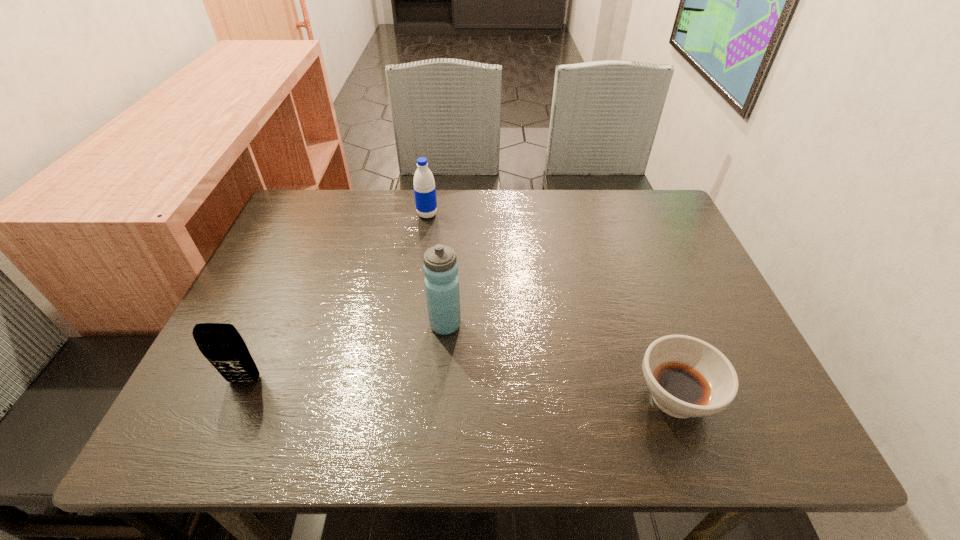
Identify the location of vacant position located 0.140m on the back of the shortest object. (645, 313).

Identify the location of object situated at the far edge. (424, 185).

At what (x,y) coordinates should I click in order to perform the action: click on object that is positioned at the near edge. Please return your answer as a coordinate pair (x, y). This screenshot has height=540, width=960. Looking at the image, I should click on (687, 377).

You are a GUI agent. You are given a task and a screenshot of the screen. Output one action in this format:
    pyautogui.click(x=<x>, y=<y>)
    Task: Click on the object positioned at the left edge
    This screenshot has width=960, height=540.
    Given the screenshot: What is the action you would take?
    [221, 344]

Find the location of a particular element. object located at the right edge is located at coordinates (687, 377).

Image resolution: width=960 pixels, height=540 pixels. Find the location of `object at the near right corner`. object at the near right corner is located at coordinates (687, 377).

Locate an element on the screen. vacant space at the far edge is located at coordinates (470, 240).

The width and height of the screenshot is (960, 540). What are the coordinates of `free space at the near edge of the desktop` in the screenshot? It's located at (505, 410).

Where is `free point at the left edge`? free point at the left edge is located at coordinates (276, 299).

In the image, there is a desktop. In order to click on blank space at the right edge in this screenshot , I will do (730, 348).